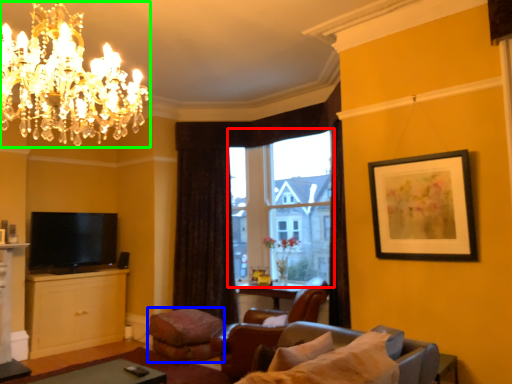
Question: Based on their relative distances, which object is farther from window (highlighted by a red box)? Choose from footrest (highlighted by a blue box) and chandelier (highlighted by a green box).

Choices:
 (A) footrest
 (B) chandelier

Answer: (B)